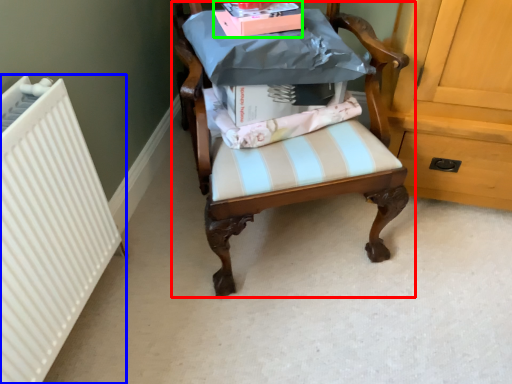
Question: Estimate the real-world distances between objects in this image. Which object is closer to chair (highlighted by a red box), radiator (highlighted by a blue box) or book (highlighted by a green box)?

Choices:
 (A) radiator
 (B) book

Answer: (B)